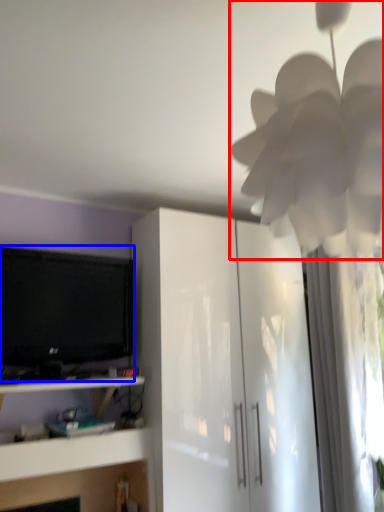
Question: Which object is closer to the camera taking this photo, flower (highlighted by a red box) or television (highlighted by a blue box)?

Choices:
 (A) flower
 (B) television

Answer: (A)